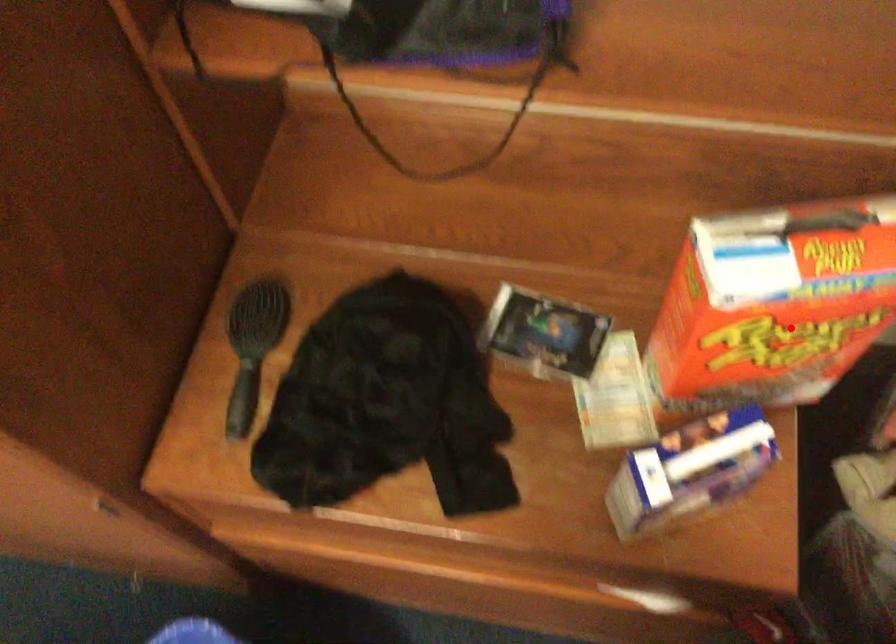
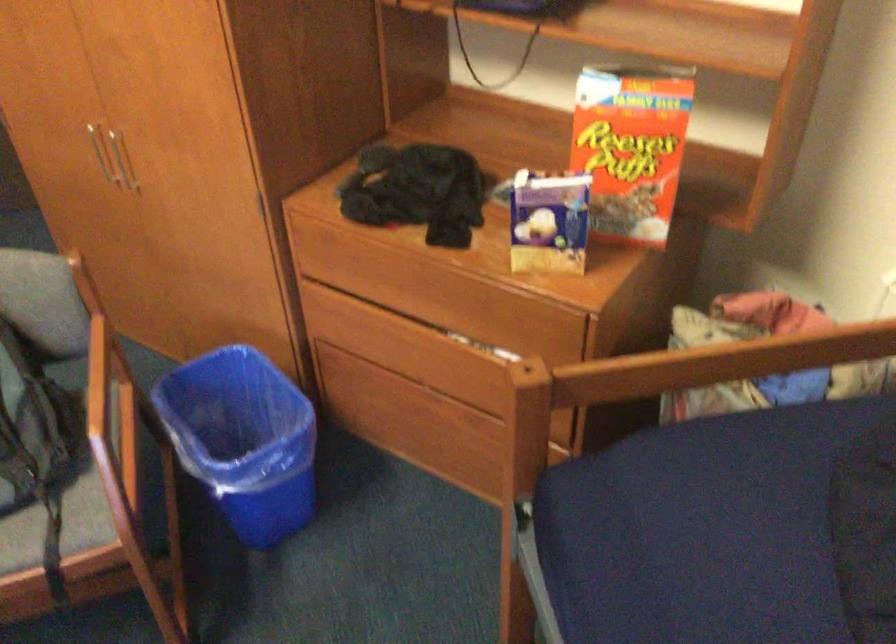
The point at the highlighted location is marked in the first image. Where is the corresponding point in the second image?

(631, 146)